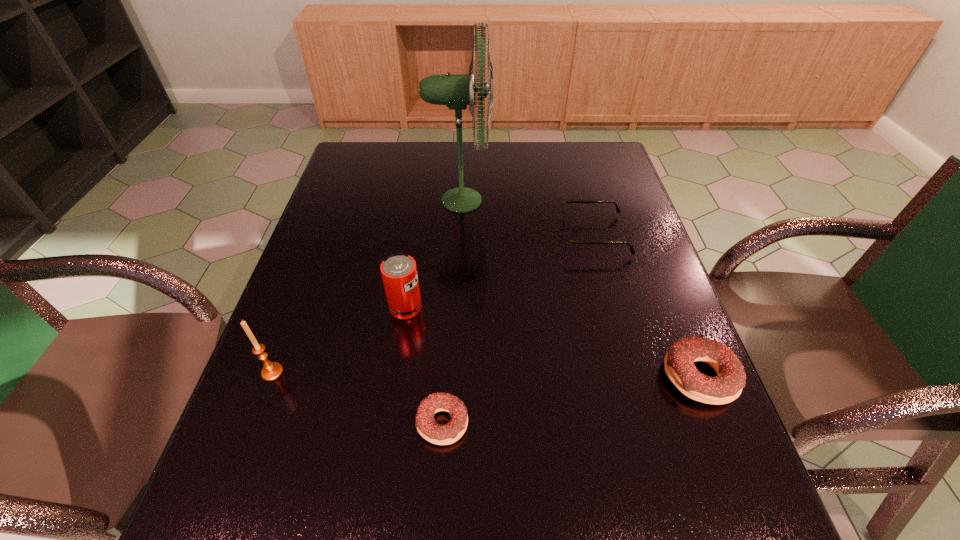
Locate an element on the screen. The image size is (960, 540). spectacles at the right edge is located at coordinates (569, 242).

In the image, there is a desktop. Where is `vacant space at the far edge`? Image resolution: width=960 pixels, height=540 pixels. vacant space at the far edge is located at coordinates point(464,167).

I want to click on free space at the near edge, so click(x=432, y=452).

Find the location of a particular element. free space at the left edge is located at coordinates (326, 296).

The image size is (960, 540). I want to click on free space at the right edge of the desktop, so click(591, 180).

Image resolution: width=960 pixels, height=540 pixels. Find the location of `free spot at the far left corner of the desktop`. free spot at the far left corner of the desktop is located at coordinates (376, 166).

In the image, there is a desktop. Identify the location of free space at the far right corner. The width and height of the screenshot is (960, 540). (601, 151).

Where is `empty location between the tallest object and the candle_holder`? This screenshot has height=540, width=960. empty location between the tallest object and the candle_holder is located at coordinates (367, 286).

This screenshot has height=540, width=960. I want to click on empty space that is in between the can and the shortest object, so click(x=424, y=365).

Identify the location of free area in between the tallest object and the right doughnut. The image size is (960, 540). 580,288.